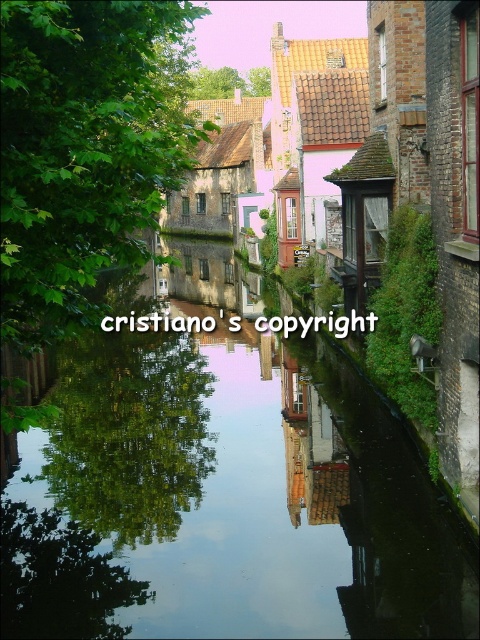
Consider the image. You are a tourist standing on the right side of the canal and want to take a photo of both the green leafy tree at center and the green leafy tree at upper center. Which tree should you move towards to get both in the frame?

You should move towards the green leafy tree at upper center because the green leafy tree at center is positioned on the left side of it, so both will be in the frame when centered on the upper tree.

Consider the image. You are standing on the left side of the canal and want to take a photo of the green reflective water at center. Where should you aim your camera to capture the water in the center of the photo?

You should aim your camera at the point with coordinates 0.784 on the x axis and 0.467 on the y axis to capture the green reflective water at center in the center of the photo.

Based on the photo, you are a tourist standing on the canal bank and want to take a photo of the green leafy tree at upper center and the green reflective water at center. How far apart are these two objects in the scene?

The green reflective water at center is 95.11 meters away from the green leafy tree at upper center, so the distance between them is 95.11 meters.